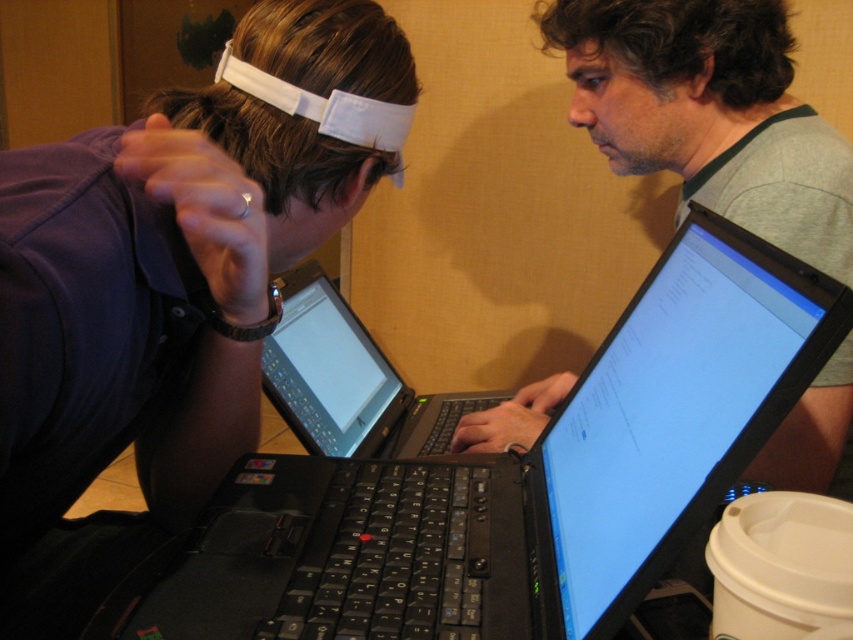
Question: Which point is closer to the camera?

Choices:
 (A) matte white forehead at upper center
 (B) black plastic laptop at center
 (C) gray-green fabric shirt at center

Answer: (A)

Question: Can you confirm if gray-green fabric shirt at center is smaller than black plastic laptop at center?

Choices:
 (A) no
 (B) yes

Answer: (A)

Question: Estimate the real-world distances between objects in this image. Which object is farther from the black plastic laptop at center?

Choices:
 (A) matte white forehead at upper center
 (B) black matte laptop at center

Answer: (A)

Question: Considering the relative positions of matte white forehead at upper center and gray-green fabric shirt at center in the image provided, where is matte white forehead at upper center located with respect to gray-green fabric shirt at center?

Choices:
 (A) below
 (B) above

Answer: (A)

Question: Can you confirm if gray-green fabric shirt at center is positioned below black plastic laptop at center?

Choices:
 (A) yes
 (B) no

Answer: (B)

Question: Which point is closer to the camera?

Choices:
 (A) (199, 420)
 (B) (813, 237)

Answer: (A)